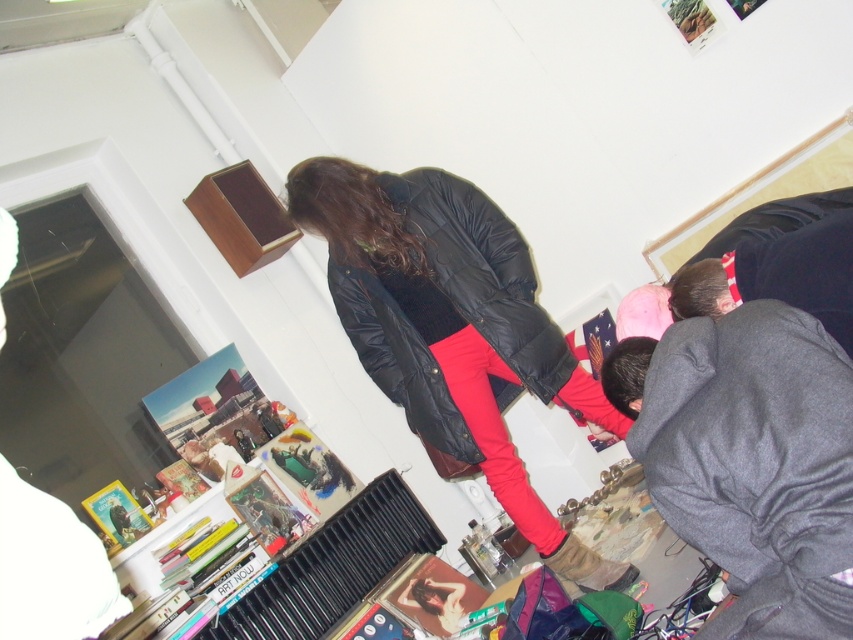
Which of these two, matte black jacket at center or black matte sweatshirt at center, stands shorter?

black matte sweatshirt at center is shorter.

Describe the element at coordinates (451, 330) in the screenshot. Image resolution: width=853 pixels, height=640 pixels. I see `matte black jacket at center` at that location.

Image resolution: width=853 pixels, height=640 pixels. What are the coordinates of `matte black jacket at center` in the screenshot? It's located at (451, 330).

Can you confirm if matte black jacket at center is taller than gray fleece sweatshirt at lower right?

Yes.

Identify the location of matte black jacket at center. (451, 330).

Describe the element at coordinates (451, 330) in the screenshot. The height and width of the screenshot is (640, 853). I see `matte black jacket at center` at that location.

Locate an element on the screen. The image size is (853, 640). matte black jacket at center is located at coordinates (451, 330).

Between gray fleece sweatshirt at lower right and black matte sweatshirt at center, which one has more height?

With more height is black matte sweatshirt at center.

Is gray fleece sweatshirt at lower right shorter than black matte sweatshirt at center?

Yes.

Is point (759, 509) closer to viewer compared to point (380, 317)?

Yes, it is.

The width and height of the screenshot is (853, 640). What are the coordinates of `gray fleece sweatshirt at lower right` in the screenshot? It's located at (750, 460).